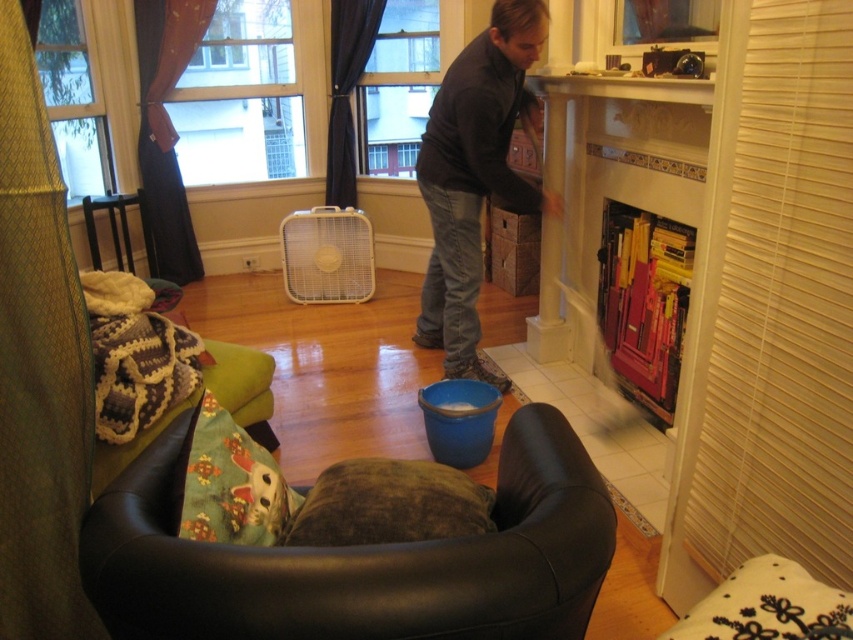
You are sitting on the black leather armchair with a plush brown cushion and want to grab the dark gray sweater at center without moving your legs. Can you reach it if the brown suede bean bag at lower center is in the way?

The brown suede bean bag at lower center is closer to the viewer than the dark gray sweater at center, so the bean bag is between you and the sweater. You cannot reach the dark gray sweater at center without moving the bean bag.

You are a person who wants to sit down on the brown suede bean bag at lower center but you are currently standing near the dark gray sweater at center. Can you easily step down to reach the bean bag?

The brown suede bean bag at lower center is located below the dark gray sweater at center, so yes, you can easily step down to reach the bean bag.